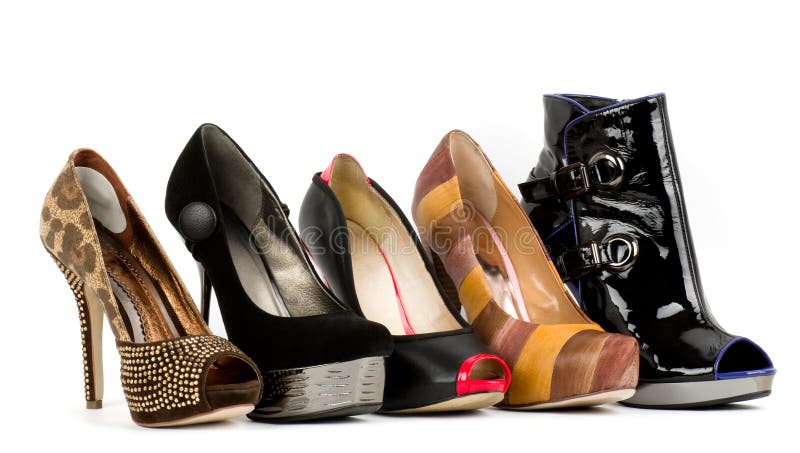
Find the location of a particular element. The width and height of the screenshot is (800, 453). shoe is located at coordinates (158, 356), (296, 342), (446, 371), (544, 357), (650, 274).